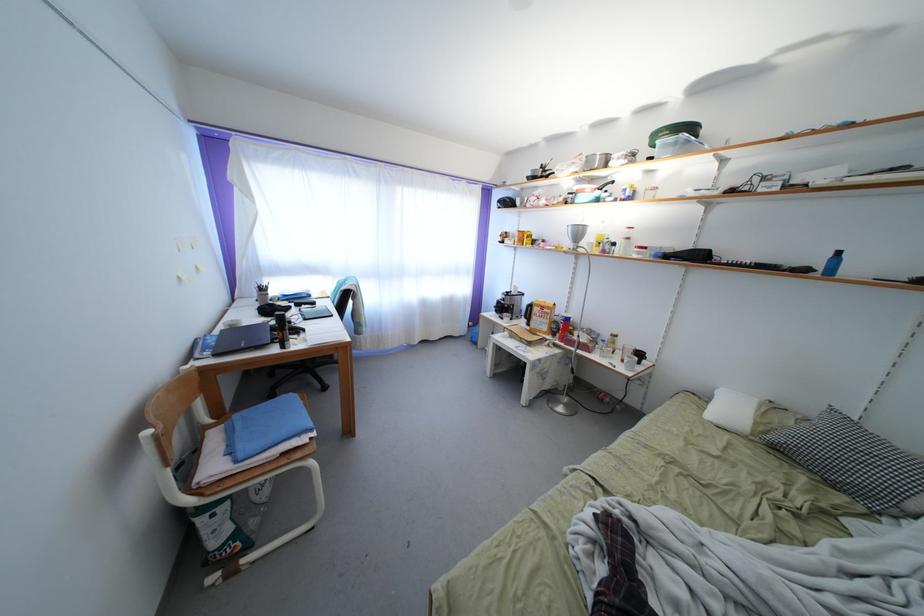
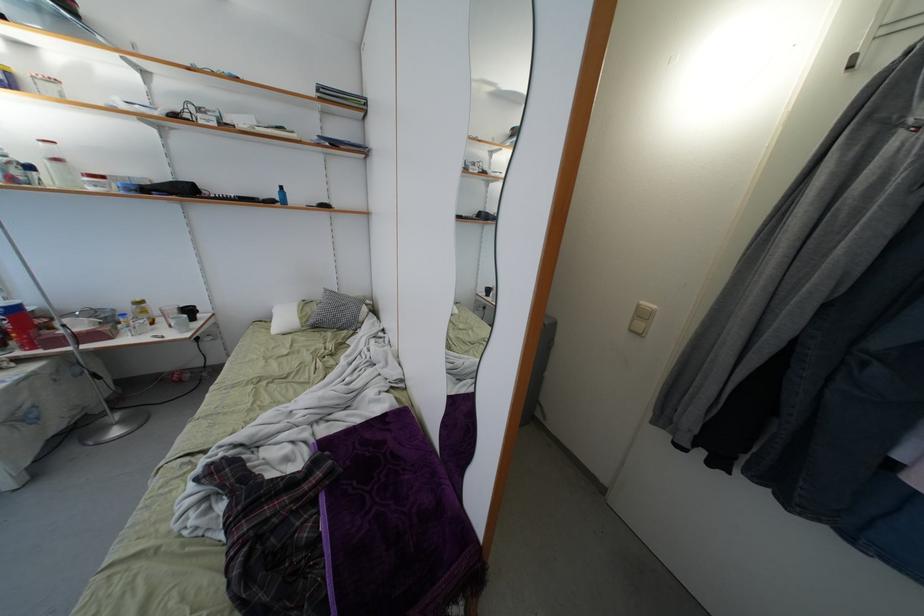
In the second image, find the point that corresponds to [568,334] in the first image.

(22, 333)